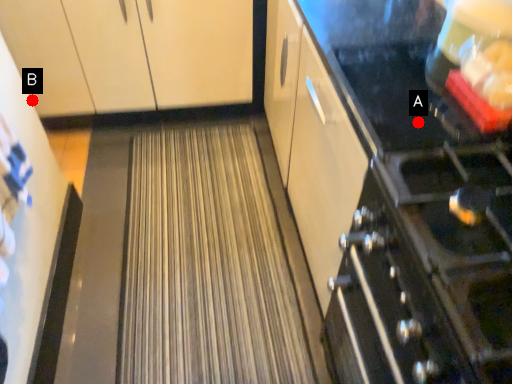
Question: Two points are circled on the image, labeled by A and B beside each circle. Among these points, which one is nearest to the camera?

Choices:
 (A) A is closer
 (B) B is closer

Answer: (A)